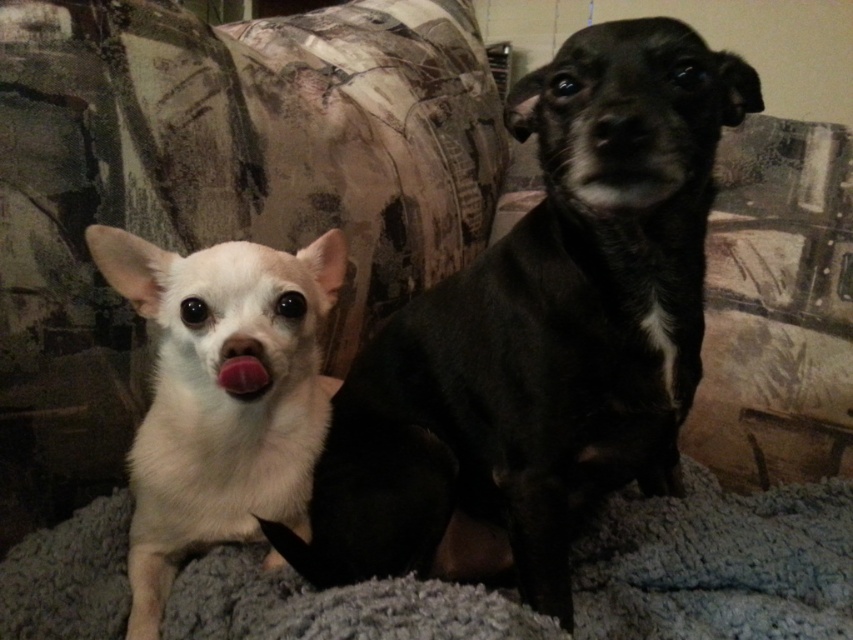
Does point (544, 230) lie in front of point (231, 358)?

No.

At what (x,y) coordinates should I click in order to perform the action: click on black smooth dog at upper center. Please return your answer as a coordinate pair (x, y). Looking at the image, I should click on (538, 339).

Find the location of a particular element. The image size is (853, 640). black smooth dog at upper center is located at coordinates (538, 339).

Can you confirm if black smooth dog at upper center is taller than pink glossy nose at center?

Correct, black smooth dog at upper center is much taller as pink glossy nose at center.

Does black smooth dog at upper center appear under pink glossy nose at center?

Actually, black smooth dog at upper center is above pink glossy nose at center.

What do you see at coordinates (538, 339) in the screenshot?
I see `black smooth dog at upper center` at bounding box center [538, 339].

Where is `black smooth dog at upper center`? This screenshot has width=853, height=640. black smooth dog at upper center is located at coordinates (538, 339).

Which of these two, gray fluffy blanket at lower center or pink glossy nose at center, stands taller?

gray fluffy blanket at lower center

Can you confirm if gray fluffy blanket at lower center is positioned below pink glossy nose at center?

Yes, gray fluffy blanket at lower center is below pink glossy nose at center.

This screenshot has width=853, height=640. What are the coordinates of `gray fluffy blanket at lower center` in the screenshot? It's located at (718, 564).

Locate an element on the screen. gray fluffy blanket at lower center is located at coordinates (718, 564).